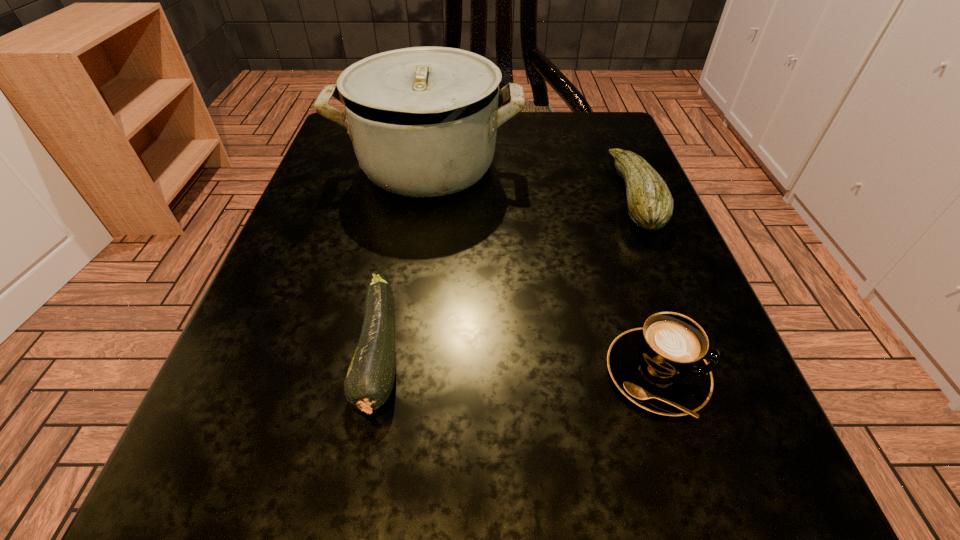
I want to click on saucepan, so click(x=423, y=121).

This screenshot has height=540, width=960. What are the coordinates of `cappuccino` in the screenshot? It's located at (661, 367).

Where is `the taller zucchini`? The width and height of the screenshot is (960, 540). the taller zucchini is located at coordinates (650, 204).

Identify the location of the right zucchini. This screenshot has height=540, width=960. (650, 204).

Where is `the nearer zucchini`? The image size is (960, 540). the nearer zucchini is located at coordinates (369, 381).

Identify the location of the left zucchini. This screenshot has height=540, width=960. (369, 381).

Identify the location of free space located 0.310m on the front of the tallest object. (396, 379).

Identify the location of vacant space positioned on the left of the cappuccino. The image size is (960, 540). (281, 374).

You are a GUI agent. You are given a task and a screenshot of the screen. Output one action in this format:
    pyautogui.click(x=<x>, y=<y>)
    Task: Click on the free space located 0.330m at the stem end of the right zucchini
    The width and height of the screenshot is (960, 540).
    Given the screenshot: What is the action you would take?
    pyautogui.click(x=418, y=195)

In order to click on blank area located at the stem end of the right zucchini in this screenshot , I will do `click(376, 195)`.